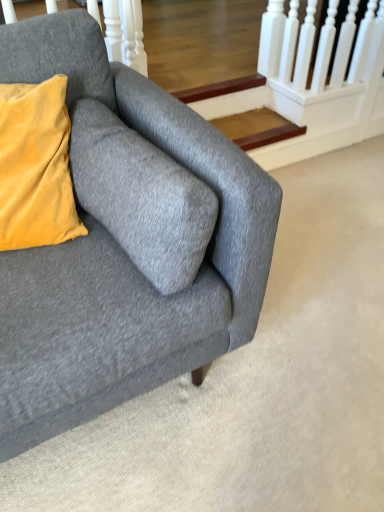
Question: In terms of size, does velvet yellow pillow at upper left appear bigger or smaller than gray fabric couch at lower left?

Choices:
 (A) big
 (B) small

Answer: (B)

Question: From the image's perspective, relative to gray fabric couch at lower left, is velvet yellow pillow at upper left above or below?

Choices:
 (A) below
 (B) above

Answer: (B)

Question: Considering the positions of point (99, 77) and point (9, 304), is point (99, 77) closer or farther from the camera than point (9, 304)?

Choices:
 (A) farther
 (B) closer

Answer: (A)

Question: Considering the positions of gray fabric couch at lower left and velvet yellow pillow at upper left in the image, is gray fabric couch at lower left bigger or smaller than velvet yellow pillow at upper left?

Choices:
 (A) big
 (B) small

Answer: (A)

Question: Is gray fabric couch at lower left inside the boundaries of velvet yellow pillow at upper left, or outside?

Choices:
 (A) inside
 (B) outside

Answer: (B)

Question: Is gray fabric couch at lower left to the left or to the right of velvet yellow pillow at upper left in the image?

Choices:
 (A) right
 (B) left

Answer: (A)

Question: From a real-world perspective, is gray fabric couch at lower left positioned above or below velvet yellow pillow at upper left?

Choices:
 (A) below
 (B) above

Answer: (A)